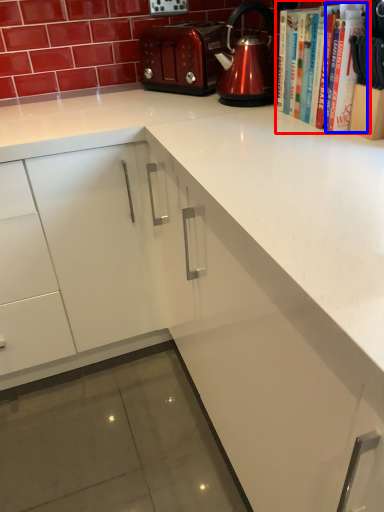
Question: Which of the following is the farthest to the observer, book (highlighted by a red box) or book (highlighted by a blue box)?

Choices:
 (A) book
 (B) book

Answer: (A)